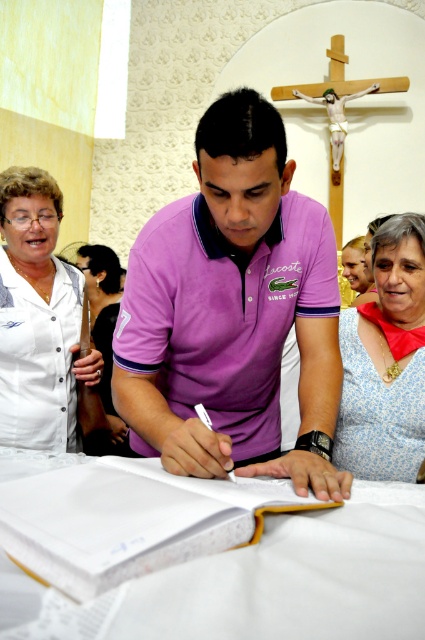
Looking at this image, you are a photographer trying to capture both the purple cotton polo shirt at center and the blue floral dress at lower right in a single frame. Given their sizes, which one should you focus on to ensure both are clearly visible?

The purple cotton polo shirt at center is larger in size than the blue floral dress at lower right, so focusing on the purple cotton polo shirt at center would allow both to be clearly visible as it takes up more space in the frame.

You are standing in the church and need to place a small bouquet of flowers on the table where the white paper book at center is located. Based on the scene description, where exactly should you place the bouquet relative to the book?

The white paper book at center is located at point [130,520], so you should place the bouquet near that coordinate on the table to ensure it is near the book.